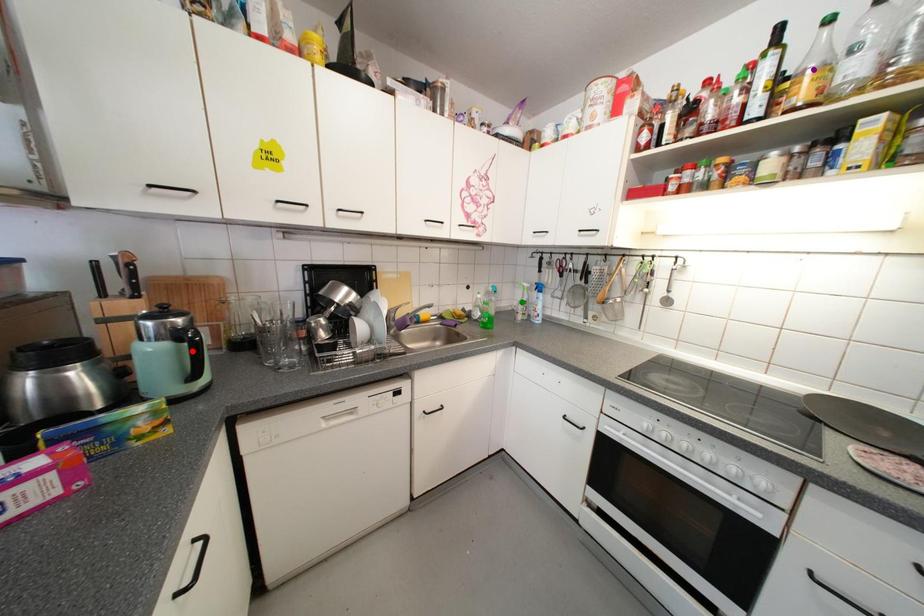
Looking at this image, order these from nearest to farthest:
1. red point
2. purple point
3. green point

purple point
red point
green point